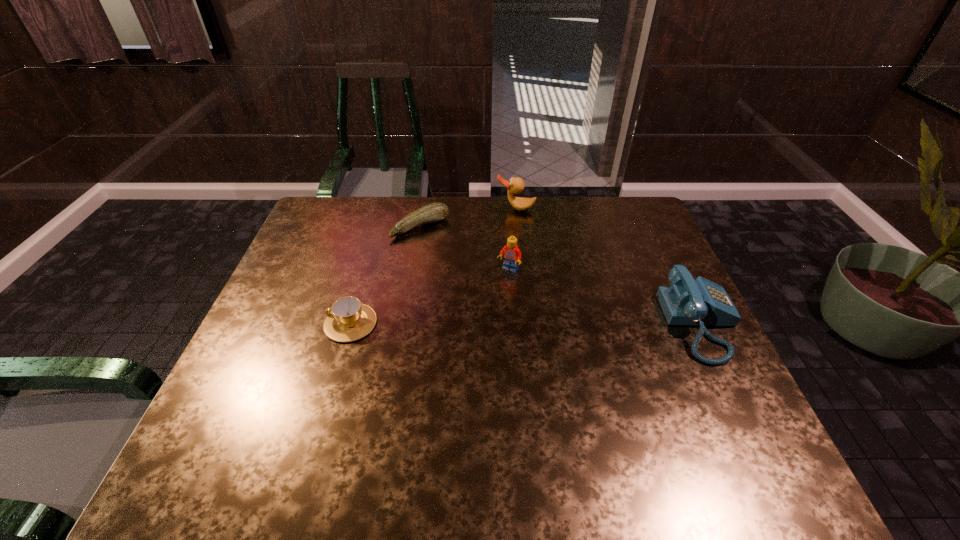
Locate an element on the screen. vacant region between the zucchini and the telephone is located at coordinates (561, 275).

Where is `vacant region between the cup and the telephone`? vacant region between the cup and the telephone is located at coordinates (526, 323).

At what (x,y) coordinates should I click in order to perform the action: click on vacant area between the cup and the fourth nearest object. Please return your answer as a coordinate pair (x, y). The width and height of the screenshot is (960, 540). Looking at the image, I should click on (385, 275).

The width and height of the screenshot is (960, 540). In order to click on free spot between the cup and the Lego in this screenshot , I will do `click(429, 296)`.

I want to click on empty space between the duck and the telephone, so click(x=609, y=266).

Identify the location of free point between the zucchini and the Lego. (465, 248).

Locate an element on the screen. Image resolution: width=960 pixels, height=540 pixels. object that is the fourth closest to the farthest object is located at coordinates (349, 320).

The height and width of the screenshot is (540, 960). Identify the location of object that ranks as the fourth closest to the duck. (349, 320).

This screenshot has height=540, width=960. I want to click on vacant area in the image that satisfies the following two spatial constraints: 1. on the front side of the telephone; 2. on the dial of the second farthest object, so click(x=404, y=323).

Where is `vacant area that satisfies the following two spatial constraints: 1. on the front side of the third farthest object; 2. on the dial of the rightmost object`? Image resolution: width=960 pixels, height=540 pixels. vacant area that satisfies the following two spatial constraints: 1. on the front side of the third farthest object; 2. on the dial of the rightmost object is located at coordinates (513, 323).